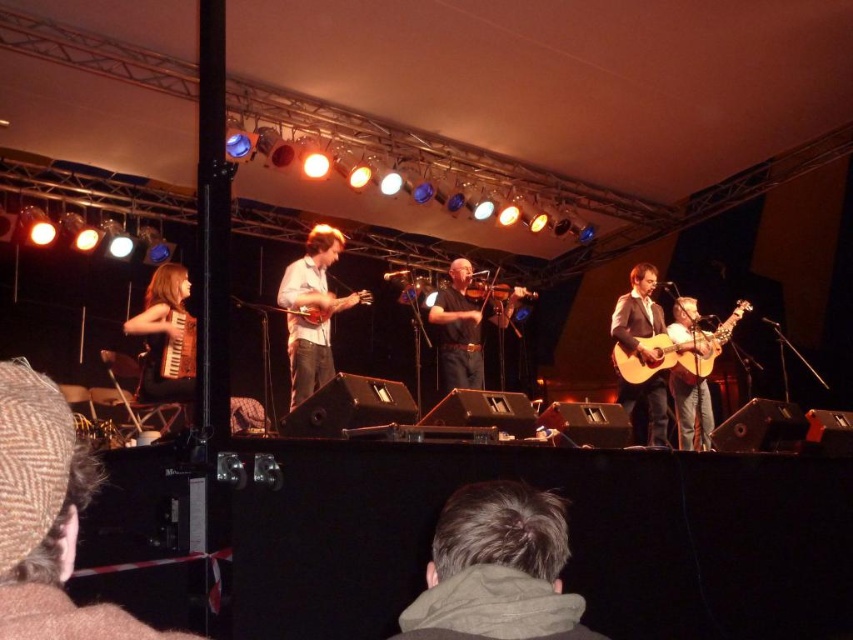
Between brown woolen hat at lower left and acoustic wood guitar at right, which one has more height?

Standing taller between the two is acoustic wood guitar at right.

Can you confirm if brown woolen hat at lower left is thinner than acoustic wood guitar at right?

Correct, brown woolen hat at lower left's width is less than acoustic wood guitar at right's.

The width and height of the screenshot is (853, 640). Find the location of `brown woolen hat at lower left`. brown woolen hat at lower left is located at coordinates (47, 516).

Identify the location of wooden violin at center. Image resolution: width=853 pixels, height=640 pixels. (457, 330).

Does wooden violin at center have a smaller size compared to acoustic wood guitar at right?

Incorrect, wooden violin at center is not smaller in size than acoustic wood guitar at right.

Between point (520, 288) and point (724, 321), which one is positioned behind?

The point (520, 288) is behind.

At what (x,y) coordinates should I click in order to perform the action: click on wooden violin at center. Please return your answer as a coordinate pair (x, y). Image resolution: width=853 pixels, height=640 pixels. Looking at the image, I should click on (457, 330).

Between white matte guitar at center and acoustic guitar at center, which one has less height?

white matte guitar at center is shorter.

Consider the image. Who is taller, white matte guitar at center or acoustic guitar at center?

acoustic guitar at center is taller.

You are a GUI agent. You are given a task and a screenshot of the screen. Output one action in this format:
    pyautogui.click(x=<x>, y=<y>)
    Task: Click on the white matte guitar at center
    
    Given the screenshot: What is the action you would take?
    pyautogui.click(x=312, y=310)